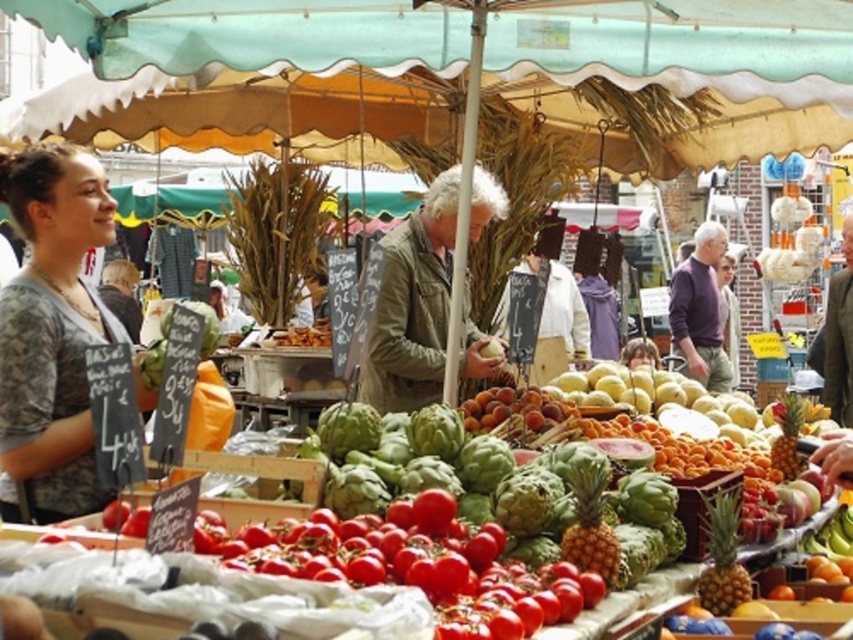
Question: Is camouflage shirt at center below khaki textured jacket at center?

Choices:
 (A) no
 (B) yes

Answer: (A)

Question: Is camouflage shirt at center further to the viewer compared to khaki textured jacket at center?

Choices:
 (A) no
 (B) yes

Answer: (A)

Question: Which of the following is the closest to the observer?

Choices:
 (A) (428, 342)
 (B) (4, 330)

Answer: (B)

Question: Observing the image, what is the correct spatial positioning of camouflage shirt at center in reference to khaki textured jacket at center?

Choices:
 (A) above
 (B) below

Answer: (A)